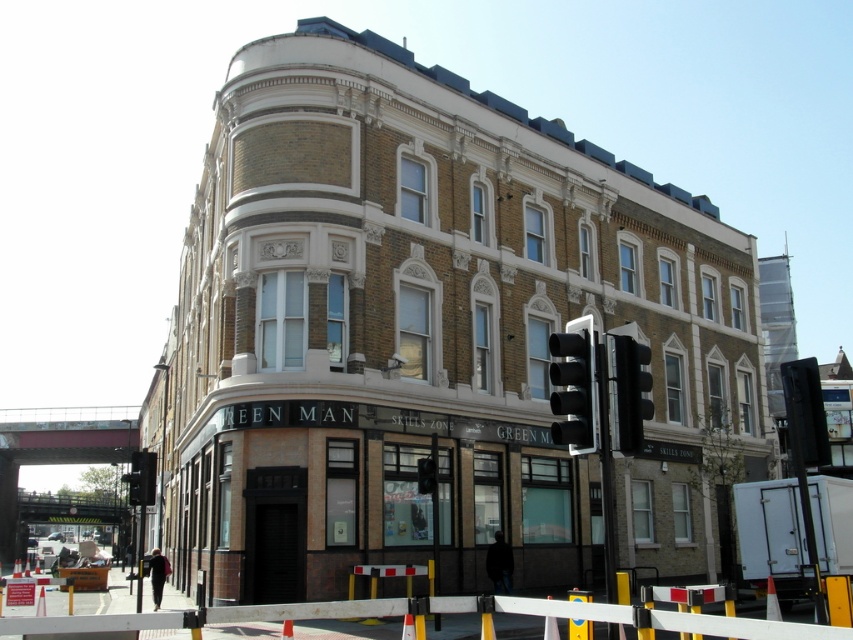
Question: Which object is closer to the camera taking this photo?

Choices:
 (A) black plastic traffic light at right
 (B) black plastic traffic light at lower left
 (C) black glass traffic light at right

Answer: (C)

Question: Is black plastic traffic light at upper right below black plastic barricade at lower center?

Choices:
 (A) no
 (B) yes

Answer: (A)

Question: Which point is farther from the camera taking this photo?

Choices:
 (A) (149, 493)
 (B) (625, 378)
 (C) (593, 365)
 (D) (809, 374)

Answer: (A)

Question: Can you confirm if black glass traffic light at right is thinner than black plastic barricade at lower center?

Choices:
 (A) no
 (B) yes

Answer: (A)

Question: Based on their relative distances, which object is farther from the black plastic traffic light at lower left?

Choices:
 (A) black glass traffic light at right
 (B) black plastic traffic light at right
 (C) black plastic barricade at lower center

Answer: (B)

Question: Is black glass traffic light at right wider than black plastic traffic light at right?

Choices:
 (A) no
 (B) yes

Answer: (A)